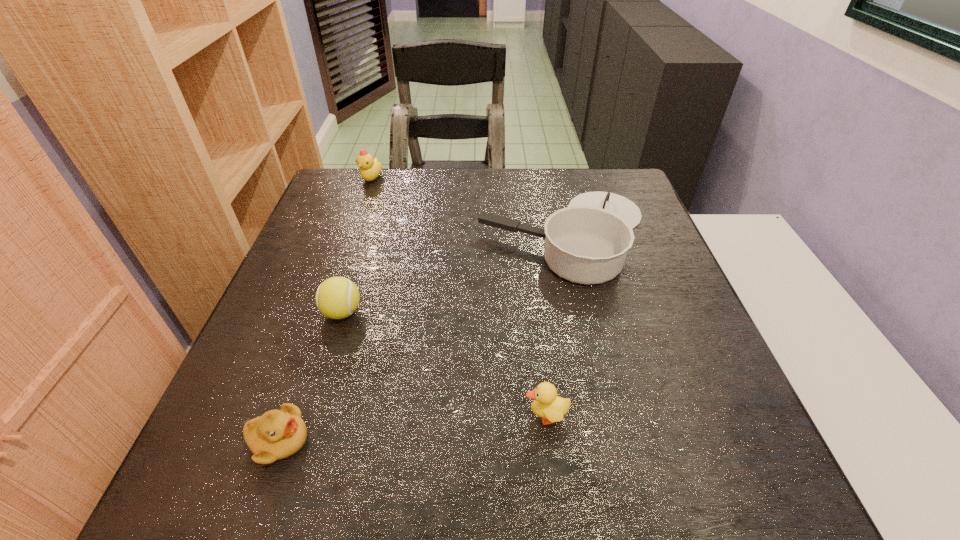
Locate an element on the screen. This screenshot has width=960, height=540. vacant space located 0.110m on the front-facing side of the rightmost duckling is located at coordinates (460, 416).

The height and width of the screenshot is (540, 960). Identify the location of duckling that is positioned at the far edge. (370, 169).

The image size is (960, 540). Find the location of `saucepan that is positioned at the far edge`. saucepan that is positioned at the far edge is located at coordinates (587, 242).

This screenshot has width=960, height=540. I want to click on object that is at the near edge, so click(277, 434).

Find the location of a particular element. The image size is (960, 540). tennis ball that is at the left edge is located at coordinates (337, 297).

The height and width of the screenshot is (540, 960). I want to click on object that is at the right edge, so coord(587,242).

Image resolution: width=960 pixels, height=540 pixels. Identify the location of object that is positioned at the far left corner. (370, 169).

This screenshot has width=960, height=540. I want to click on object situated at the near left corner, so click(x=277, y=434).

The height and width of the screenshot is (540, 960). In order to click on object that is at the far right corner in this screenshot , I will do `click(587, 242)`.

This screenshot has height=540, width=960. In order to click on vacant space at the far edge in this screenshot , I will do `click(571, 170)`.